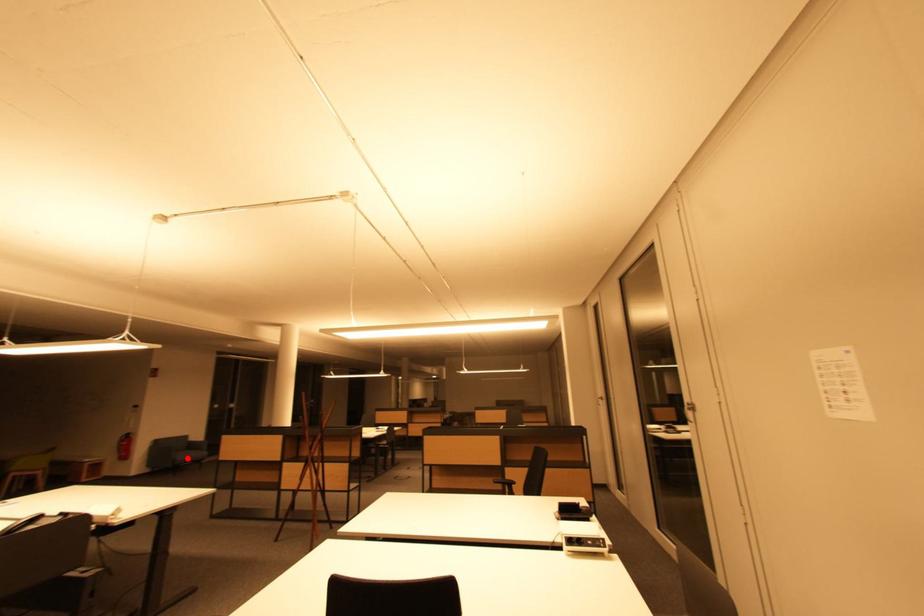
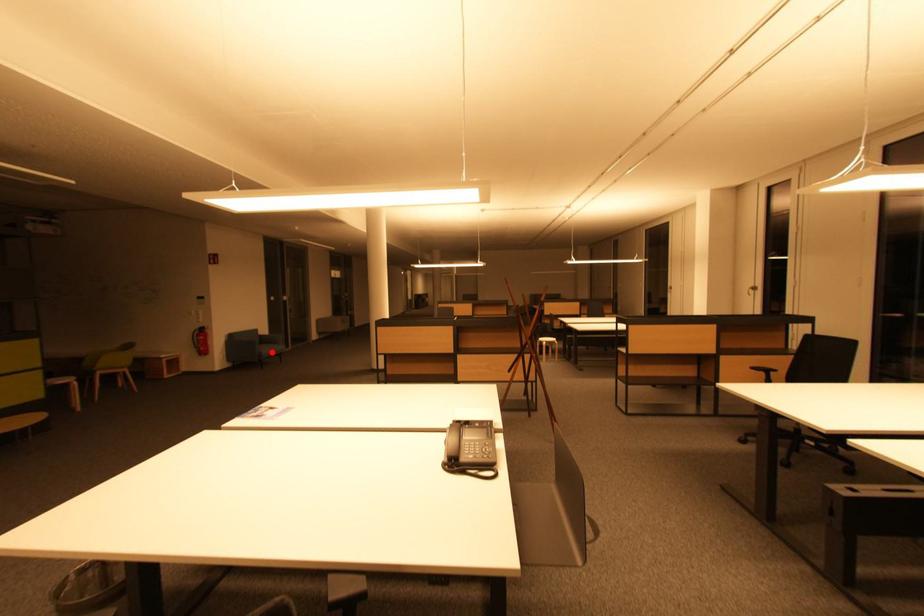
I am providing you with two images of the same scene from different viewpoints. A red point is marked on the first image and another point is marked on the second image. Does the point marked in image1 correspond to the same location as the one in image2?

Yes